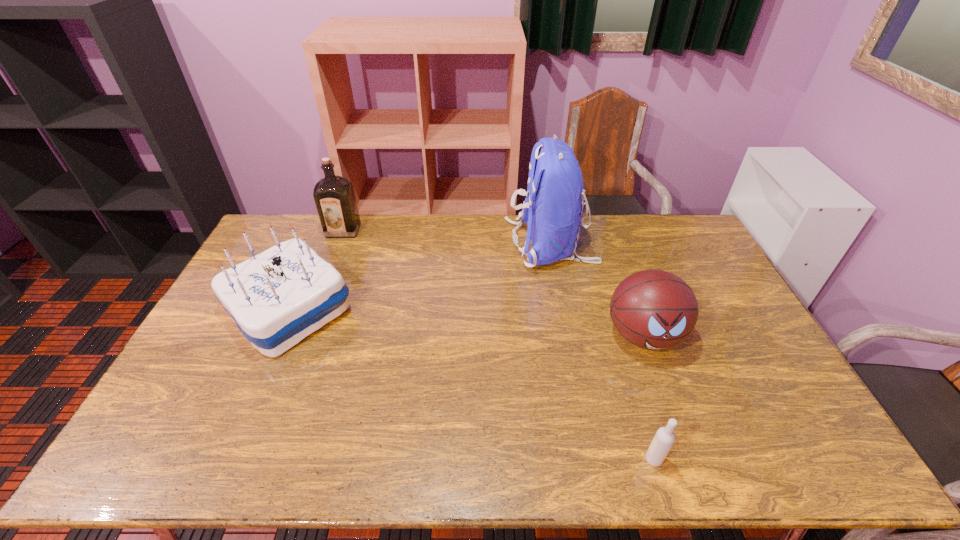
Find the location of a particular element. vacant space in between the liquor and the tallest object is located at coordinates (447, 237).

The image size is (960, 540). I want to click on vacant point located between the fourth tallest object and the backpack, so click(x=597, y=289).

Locate an element on the screen. This screenshot has width=960, height=540. vacant space that's between the tallest object and the liquor is located at coordinates (447, 237).

Find the location of a particular element. This screenshot has height=540, width=960. free space between the nearest object and the backpack is located at coordinates (602, 352).

Locate an element on the screen. Image resolution: width=960 pixels, height=540 pixels. unoccupied area between the nearest object and the fourth tallest object is located at coordinates click(x=648, y=397).

Find the location of a particular element. Image resolution: width=960 pixels, height=540 pixels. vacant area that lies between the birthday cake and the vodka is located at coordinates (471, 384).

Locate an element on the screen. Image resolution: width=960 pixels, height=540 pixels. free point between the birthday cake and the tallest object is located at coordinates (420, 276).

Identify the location of free spot between the liquor and the nearest object. (498, 345).

Identify the location of free space that is in between the tallest object and the basketball. (597, 289).

This screenshot has width=960, height=540. I want to click on empty location between the basketball and the tallest object, so click(x=597, y=289).